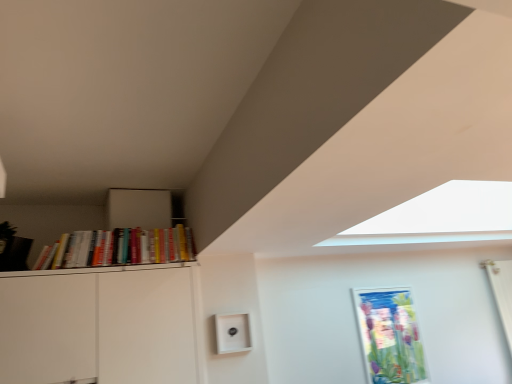
The image size is (512, 384). I want to click on metallic silver picture frame at center-right, so click(389, 336).

Image resolution: width=512 pixels, height=384 pixels. Describe the element at coordinates (389, 336) in the screenshot. I see `metallic silver picture frame at center-right` at that location.

Measure the distance between point (x=397, y=346) and camera.

Answer: Point (x=397, y=346) and camera are 3.61 meters apart from each other.

I want to click on hardcover books at left, so click(118, 248).

The width and height of the screenshot is (512, 384). What do you see at coordinates (118, 248) in the screenshot? I see `hardcover books at left` at bounding box center [118, 248].

Locate an element on the screen. Image resolution: width=512 pixels, height=384 pixels. metallic silver picture frame at center-right is located at coordinates (389, 336).

Which is more to the right, hardcover books at left or metallic silver picture frame at center-right?

→ Positioned to the right is metallic silver picture frame at center-right.

Is hardcover books at left in front of or behind metallic silver picture frame at center-right in the image?

Clearly, hardcover books at left is in front of metallic silver picture frame at center-right.

Considering the points (83, 237) and (382, 364), which point is behind, point (83, 237) or point (382, 364)?

The point (382, 364) is more distant.

From the image's perspective, is hardcover books at left on top of metallic silver picture frame at center-right?

Yes, from the image's perspective, hardcover books at left is on top of metallic silver picture frame at center-right.

From a real-world perspective, relative to metallic silver picture frame at center-right, is hardcover books at left vertically above or below?

hardcover books at left is situated higher than metallic silver picture frame at center-right in the real world.

Considering the relative sizes of hardcover books at left and metallic silver picture frame at center-right in the image provided, is hardcover books at left thinner than metallic silver picture frame at center-right?

No, hardcover books at left is not thinner than metallic silver picture frame at center-right.

Who is taller, hardcover books at left or metallic silver picture frame at center-right?

metallic silver picture frame at center-right is taller.

Considering the sizes of objects hardcover books at left and metallic silver picture frame at center-right in the image provided, who is bigger, hardcover books at left or metallic silver picture frame at center-right?

Bigger between the two is hardcover books at left.

In the scene shown: Is hardcover books at left spatially inside metallic silver picture frame at center-right, or outside of it?

hardcover books at left is outside metallic silver picture frame at center-right.

Are hardcover books at left and metallic silver picture frame at center-right beside each other?

No, hardcover books at left is not beside metallic silver picture frame at center-right.

Is metallic silver picture frame at center-right at the back of hardcover books at left?

hardcover books at left is not turned away from metallic silver picture frame at center-right.

At what (x,y) coordinates should I click in order to perform the action: click on picture frame below the hardcover books at left (from a real-world perspective). Please return your answer as a coordinate pair (x, y). Looking at the image, I should click on (389, 336).

Which is more to the right, metallic silver picture frame at center-right or hardcover books at left?

metallic silver picture frame at center-right.

Is metallic silver picture frame at center-right further to camera compared to hardcover books at left?

Yes, metallic silver picture frame at center-right is further from the viewer.

Is point (362, 345) closer to camera compared to point (76, 232)?

No.

From the image's perspective, is metallic silver picture frame at center-right located above or below hardcover books at left?

From the image's perspective, metallic silver picture frame at center-right appears below hardcover books at left.

From a real-world perspective, is metallic silver picture frame at center-right physically below hardcover books at left?

Yes, from a real-world perspective, metallic silver picture frame at center-right is beneath hardcover books at left.

Considering the relative sizes of metallic silver picture frame at center-right and hardcover books at left in the image provided, is metallic silver picture frame at center-right thinner than hardcover books at left?

A: Yes, metallic silver picture frame at center-right is thinner than hardcover books at left.

Does metallic silver picture frame at center-right have a greater height compared to hardcover books at left?

Yes, metallic silver picture frame at center-right is taller than hardcover books at left.

Considering the relative sizes of metallic silver picture frame at center-right and hardcover books at left in the image provided, is metallic silver picture frame at center-right bigger than hardcover books at left?

Actually, metallic silver picture frame at center-right might be smaller than hardcover books at left.

Can we say metallic silver picture frame at center-right lies outside hardcover books at left?

metallic silver picture frame at center-right is positioned outside hardcover books at left.

Is the surface of metallic silver picture frame at center-right in direct contact with hardcover books at left?

They are not placed beside each other.

Is metallic silver picture frame at center-right oriented away from hardcover books at left?

metallic silver picture frame at center-right does not have its back to hardcover books at left.

You are a GUI agent. You are given a task and a screenshot of the screen. Output one action in this format:
    pyautogui.click(x=<x>, y=<y>)
    Task: Click on the book lying on the left of metallic silver picture frame at center-right
    This screenshot has width=512, height=384.
    Given the screenshot: What is the action you would take?
    pyautogui.click(x=118, y=248)

Where is `book above the metallic silver picture frame at center-right (from a real-world perspective)`? book above the metallic silver picture frame at center-right (from a real-world perspective) is located at coordinates (118, 248).

In the image, there is a hardcover books at left. Where is `picture frame below it (from a real-world perspective)`? picture frame below it (from a real-world perspective) is located at coordinates [389, 336].